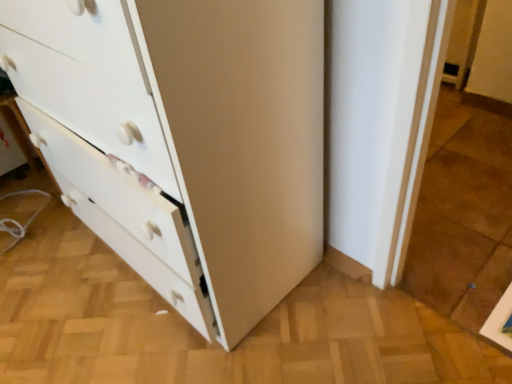
What do you see at coordinates (183, 139) in the screenshot? The width and height of the screenshot is (512, 384). I see `white glossy chest of drawers at lower left` at bounding box center [183, 139].

Find the location of `white glossy chest of drawers at lower left`. white glossy chest of drawers at lower left is located at coordinates (183, 139).

Locate an element on the screen. This screenshot has width=512, height=384. white glossy chest of drawers at lower left is located at coordinates (183, 139).